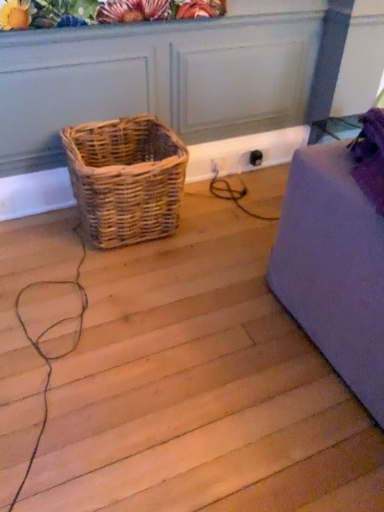
Question: Based on their positions, is matte floral arrangement at upper center located to the left or right of woven natural basket at center-left?

Choices:
 (A) left
 (B) right

Answer: (B)

Question: From their relative heights in the image, would you say matte floral arrangement at upper center is taller or shorter than woven natural basket at center-left?

Choices:
 (A) tall
 (B) short

Answer: (B)

Question: Based on their sizes in the image, would you say matte floral arrangement at upper center is bigger or smaller than woven natural basket at center-left?

Choices:
 (A) small
 (B) big

Answer: (A)

Question: Is woven natural basket at center-left situated inside matte floral arrangement at upper center or outside?

Choices:
 (A) outside
 (B) inside

Answer: (A)

Question: Visually, is woven natural basket at center-left positioned to the left or to the right of matte floral arrangement at upper center?

Choices:
 (A) left
 (B) right

Answer: (A)

Question: From a real-world perspective, is woven natural basket at center-left above or below matte floral arrangement at upper center?

Choices:
 (A) below
 (B) above

Answer: (A)

Question: Is point (129, 160) closer or farther from the camera than point (66, 13)?

Choices:
 (A) closer
 (B) farther

Answer: (B)